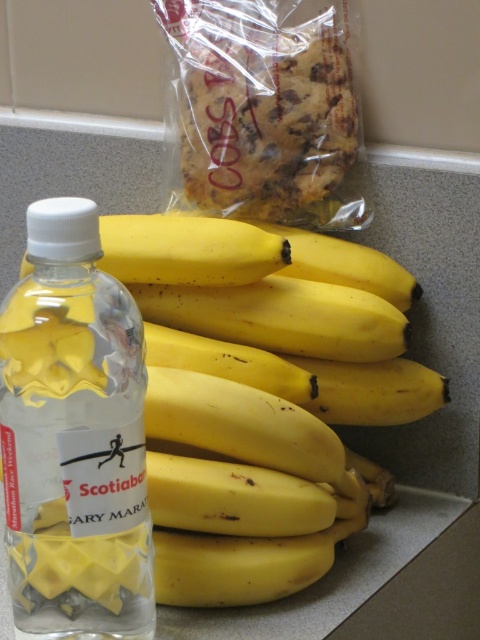
You are standing in front of the countertop and want to reach two points marked on the image. Which point, point (14, 579) or point (340, 147), is closer to you?

Point (14, 579) is closer to the viewer than point (340, 147).

From the picture: You are organizing a marathon snack station and have a yellow matte bananas at center and a golden brown cookie at upper center on the counter. Which item is positioned to the left when viewed from the front?

The yellow matte bananas at center is positioned to the left of the golden brown cookie at upper center.

You are organizing a marathon event and need to arrange the yellow matte bananas at center and the clear plastic bottle at left on a shelf. Which item should you place first if you want to arrange them from largest to smallest?

The yellow matte bananas at center should be placed first since they are larger than the clear plastic bottle at left, so arranging from largest to smallest would start with the bananas.